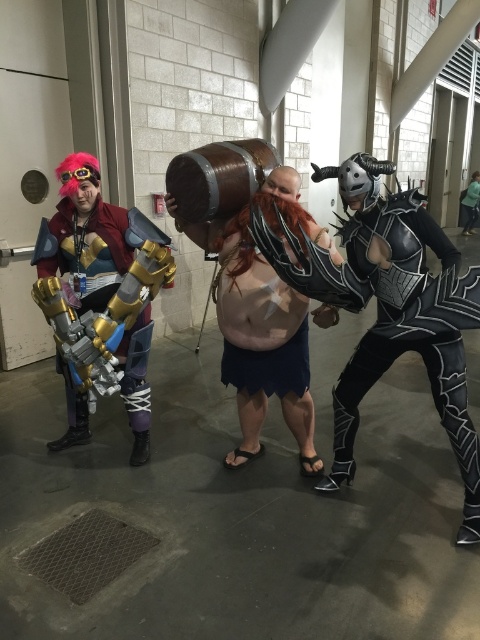
Is black leather armor at right smaller than wooden barrel at center?

Yes, black leather armor at right is smaller than wooden barrel at center.

Can you confirm if black leather armor at right is shorter than wooden barrel at center?

Incorrect, black leather armor at right's height does not fall short of wooden barrel at center's.

This screenshot has height=640, width=480. Find the location of `black leather armor at right`. black leather armor at right is located at coordinates (387, 308).

At what (x,y) coordinates should I click in order to perform the action: click on black leather armor at right. Please return your answer as a coordinate pair (x, y). The image size is (480, 640). Looking at the image, I should click on (387, 308).

Is brushed metal armor at left thinner than wooden barrel at center?

No, brushed metal armor at left is not thinner than wooden barrel at center.

Does brushed metal armor at left have a greater height compared to wooden barrel at center?

Indeed, brushed metal armor at left has a greater height compared to wooden barrel at center.

What are the coordinates of `brushed metal armor at left` in the screenshot? It's located at (101, 300).

Which is in front, point (469, 433) or point (127, 278)?

Positioned in front is point (469, 433).

Can you confirm if black leather armor at right is smaller than brushed metal armor at left?

Actually, black leather armor at right might be larger than brushed metal armor at left.

Is point (470, 502) closer to camera compared to point (119, 340)?

That is True.

Find the location of `black leather armor at right`. black leather armor at right is located at coordinates coord(387,308).